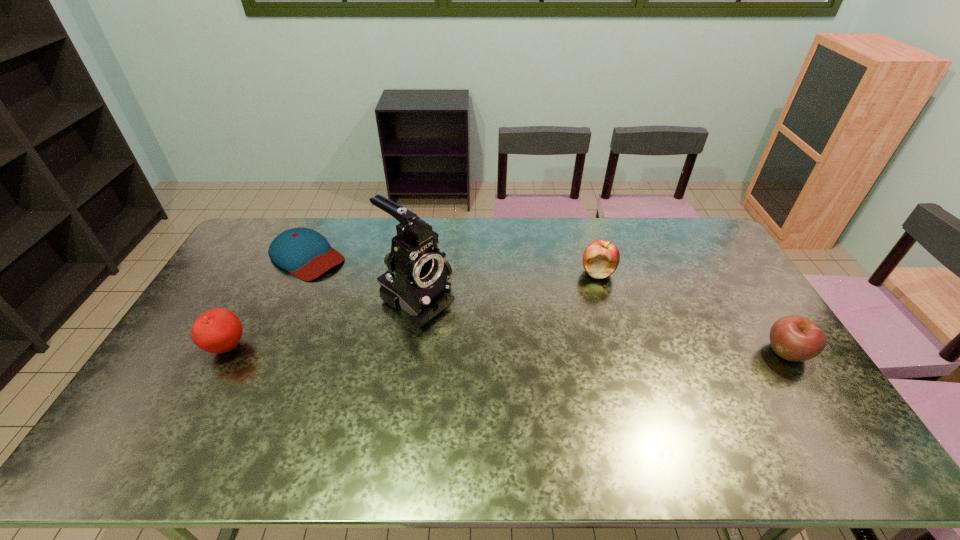
Find the location of a particular element. vacant position located 0.330m on the bitten side of the second apple from left to right is located at coordinates (505, 313).

You are a GUI agent. You are given a task and a screenshot of the screen. Output one action in this format:
    pyautogui.click(x=<x>, y=<y>)
    Task: Click on the free space located 0.300m on the bitten side of the second apple from left to right
    This screenshot has width=960, height=540.
    Given the screenshot: What is the action you would take?
    pyautogui.click(x=513, y=309)

Locate an element on the screen. The width and height of the screenshot is (960, 540). vacant space located 0.150m on the bitten side of the second apple from left to right is located at coordinates (549, 293).

Locate an element on the screen. free space located 0.170m on the lens mount of the camcorder is located at coordinates (486, 353).

What are the coordinates of `free space located 0.270m on the lens mount of the camcorder` in the screenshot? It's located at click(x=513, y=372).

What are the coordinates of `vacant space located on the lens mount of the camcorder` in the screenshot? It's located at (461, 336).

You are a GUI agent. You are given a task and a screenshot of the screen. Output one action in this format:
    pyautogui.click(x=<x>, y=<y>)
    Task: Click on the vacant space located with the bill of the shortest object facing forward
    This screenshot has height=540, width=960.
    Given the screenshot: What is the action you would take?
    pyautogui.click(x=373, y=300)

Where is `vacant region located 0.320m with the bill of the shortest object facing forward`? The height and width of the screenshot is (540, 960). vacant region located 0.320m with the bill of the shortest object facing forward is located at coordinates [x=395, y=314].

Where is `vacant area situated 0.260m with the bill of the shortest object facing forward`? vacant area situated 0.260m with the bill of the shortest object facing forward is located at coordinates (382, 305).

Image resolution: width=960 pixels, height=540 pixels. I want to click on object at the far edge, so click(x=305, y=253).